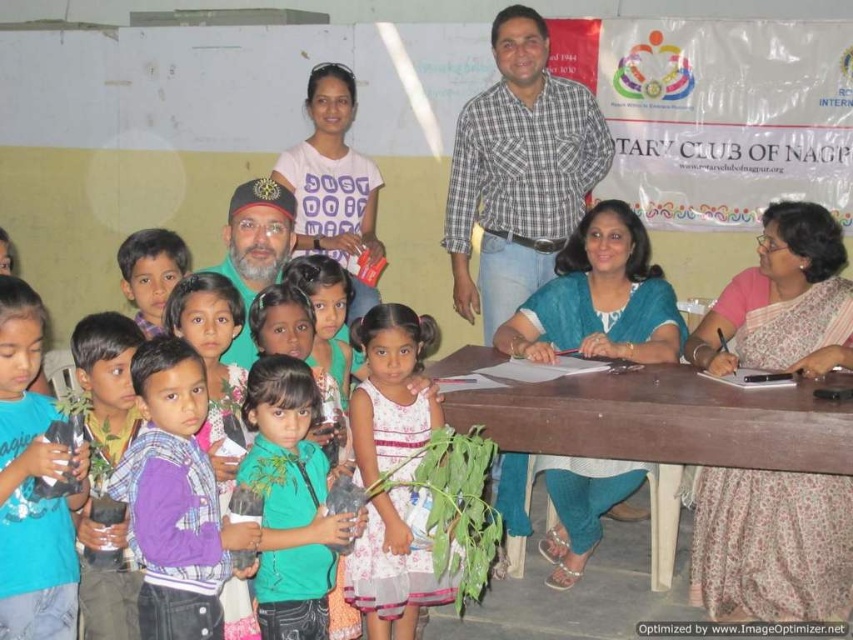
Which is behind, point (154, 428) or point (13, 628)?

Positioned behind is point (154, 428).

Which is more to the right, purple cotton shirt at center or blue matte plant at center?

purple cotton shirt at center

Is point (148, 349) closer to viewer compared to point (33, 339)?

No, it is behind (33, 339).

This screenshot has height=640, width=853. Find the location of `purple cotton shirt at center`. purple cotton shirt at center is located at coordinates (175, 499).

Which of these two, white cotton dress at center or matte green shirt at center, stands taller?

white cotton dress at center

Who is more distant from viewer, (x=386, y=451) or (x=143, y=323)?

Positioned behind is point (x=143, y=323).

This screenshot has width=853, height=640. What do you see at coordinates (392, 388) in the screenshot?
I see `white cotton dress at center` at bounding box center [392, 388].

Locate an element on the screen. This screenshot has width=853, height=640. white cotton dress at center is located at coordinates (392, 388).

Who is lower down, blue cotton shirt at center or green plastic bottle at center?

green plastic bottle at center is lower down.

Which is in front, point (532, 81) or point (263, 282)?

Point (263, 282) is more forward.

Between point (491, 314) and point (303, 348), which one is positioned in front?

Point (303, 348)

You are a GUI agent. You are given a task and a screenshot of the screen. Output one action in this format:
    pyautogui.click(x=<x>, y=<y>)
    Task: Click on the blue cotton shirt at center
    
    Given the screenshot: What is the action you would take?
    pyautogui.click(x=519, y=172)